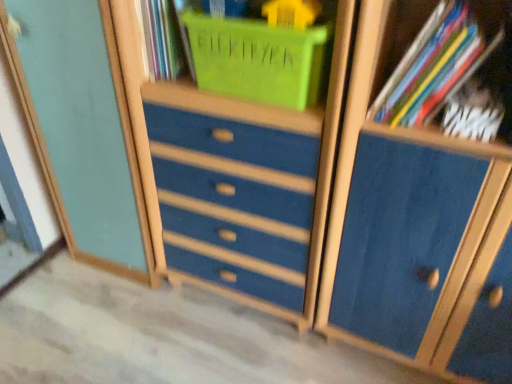
Question: Is blue matte cabinet at center at the left side of matte plastic basket at upper center?

Choices:
 (A) yes
 (B) no

Answer: (B)

Question: Does blue matte cabinet at center have a smaller size compared to matte plastic basket at upper center?

Choices:
 (A) no
 (B) yes

Answer: (A)

Question: Could you tell me if blue matte cabinet at center is turned towards matte plastic basket at upper center?

Choices:
 (A) no
 (B) yes

Answer: (A)

Question: Is blue matte cabinet at center looking in the opposite direction of matte plastic basket at upper center?

Choices:
 (A) no
 (B) yes

Answer: (A)

Question: Can you confirm if blue matte cabinet at center is taller than matte plastic basket at upper center?

Choices:
 (A) yes
 (B) no

Answer: (A)

Question: Is matte plastic basket at upper center surrounded by blue matte cabinet at center?

Choices:
 (A) no
 (B) yes

Answer: (A)

Question: Is there a large distance between blue matte cabinet at center and blue painted wood dresser at center?

Choices:
 (A) yes
 (B) no

Answer: (B)

Question: Does blue matte cabinet at center turn towards blue painted wood dresser at center?

Choices:
 (A) yes
 (B) no

Answer: (B)

Question: Can you confirm if blue matte cabinet at center is shorter than blue painted wood dresser at center?

Choices:
 (A) no
 (B) yes

Answer: (A)

Question: Is blue matte cabinet at center bigger than blue painted wood dresser at center?

Choices:
 (A) yes
 (B) no

Answer: (A)

Question: Does blue matte cabinet at center come behind blue painted wood dresser at center?

Choices:
 (A) no
 (B) yes

Answer: (A)

Question: Can you confirm if blue matte cabinet at center is wider than blue painted wood dresser at center?

Choices:
 (A) no
 (B) yes

Answer: (B)

Question: Can you confirm if blue painted wood dresser at center is wider than multicolored paper at upper right, the second book in the bottom-to-top sequence?

Choices:
 (A) no
 (B) yes

Answer: (B)